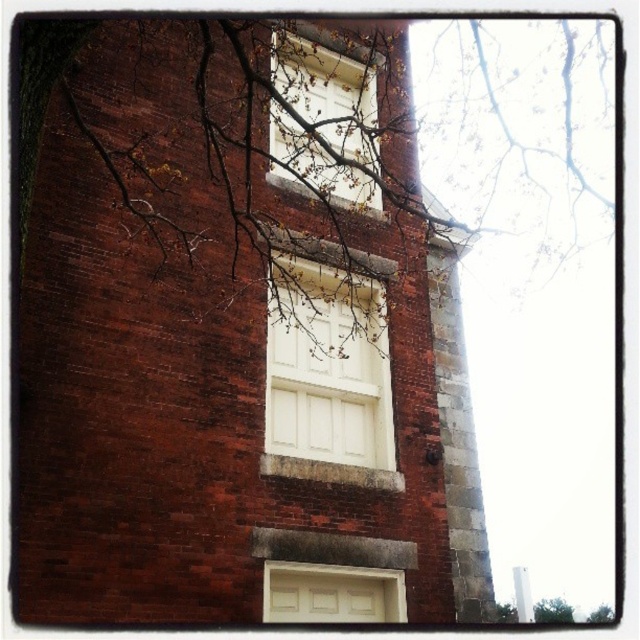
Can you confirm if bare branches at upper center is shorter than white matte door at center?

In fact, bare branches at upper center may be taller than white matte door at center.

Based on the photo, is bare branches at upper center wider than white matte door at center?

Yes, bare branches at upper center is wider than white matte door at center.

Is point (317, 36) behind point (284, 268)?

That is True.

At what (x,y) coordinates should I click in order to perform the action: click on bare branches at upper center. Please return your answer as a coordinate pair (x, y). The width and height of the screenshot is (640, 640). Looking at the image, I should click on (300, 136).

Between bare branches at upper center and bare branches at lower right, which one has more height?

bare branches at upper center

How distant is bare branches at upper center from bare branches at lower right?

The distance of bare branches at upper center from bare branches at lower right is 27.87 feet.

This screenshot has height=640, width=640. What do you see at coordinates (300, 136) in the screenshot? I see `bare branches at upper center` at bounding box center [300, 136].

Where is `bare branches at upper center`? Image resolution: width=640 pixels, height=640 pixels. bare branches at upper center is located at coordinates (300, 136).

Does white matte door at center have a lesser height compared to green leafy tree at lower right?

Yes.

Can you confirm if white matte door at center is positioned to the right of green leafy tree at lower right?

Incorrect, white matte door at center is not on the right side of green leafy tree at lower right.

At what (x,y) coordinates should I click in order to perform the action: click on white matte door at center. Please return your answer as a coordinate pair (x, y). The width and height of the screenshot is (640, 640). Looking at the image, I should click on (326, 368).